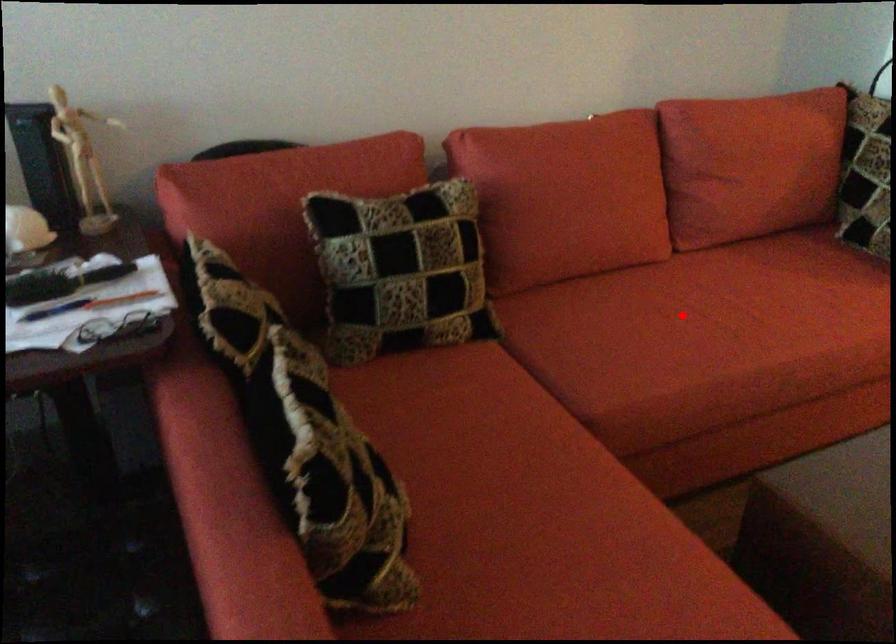
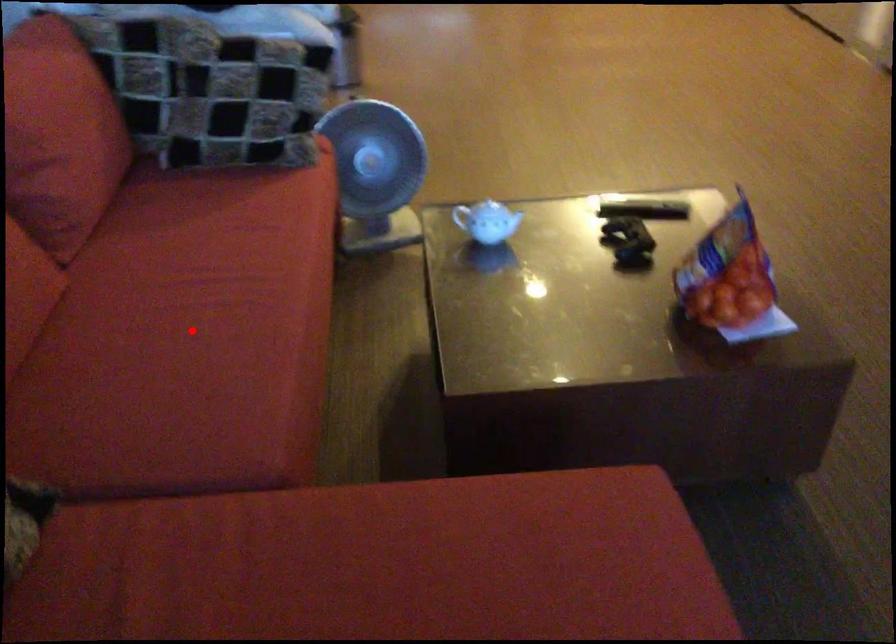
I am providing you with two images of the same scene from different viewpoints. A red point is marked on the first image and another point is marked on the second image. Does the point marked in image1 correspond to the same location as the one in image2?

Yes